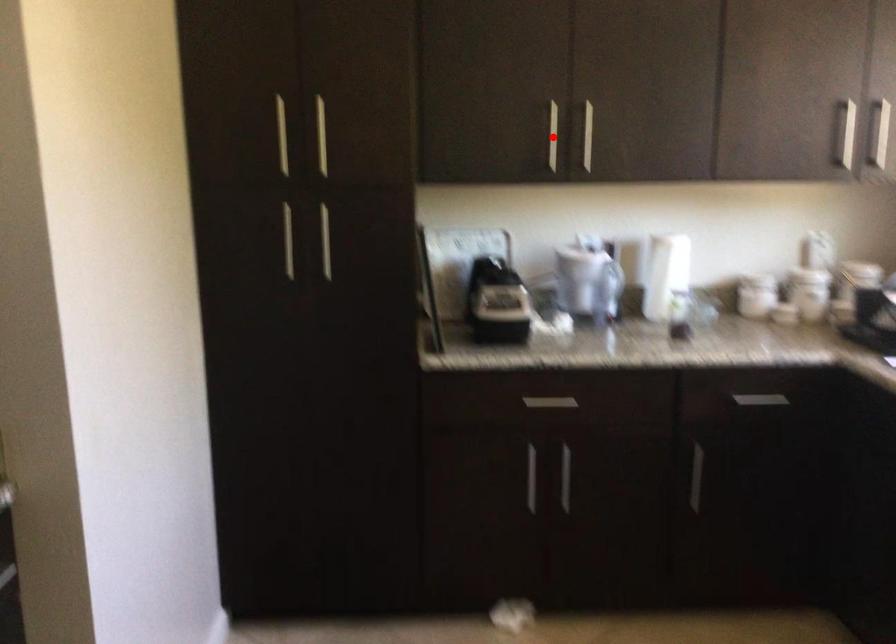
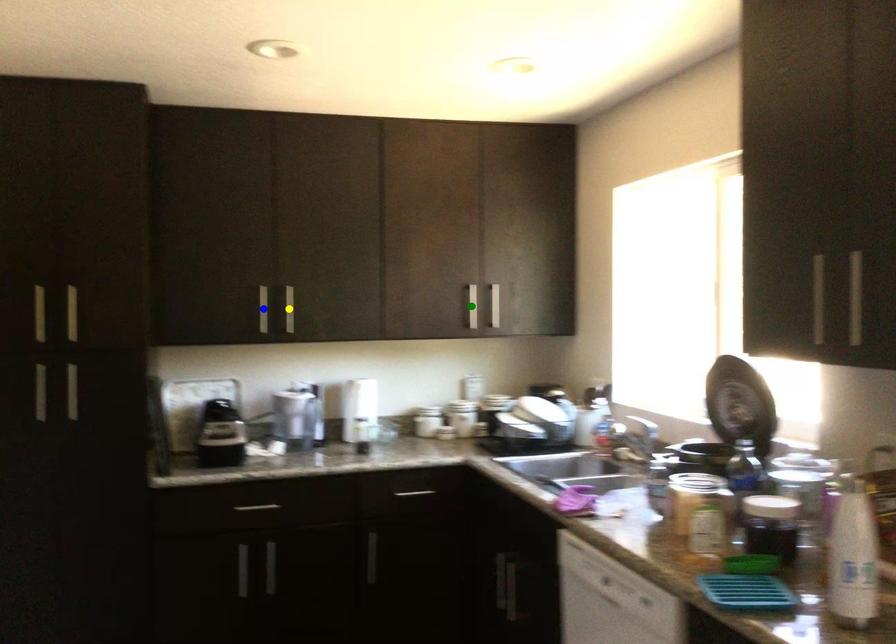
Question: I am providing you with two images of the same scene from different viewpoints. A red point is marked on the first image. You are given multiple points on the second image. Which point in image 2 is actually the same real-world point as the red point in image 1?

Choices:
 (A) green point
 (B) blue point
 (C) yellow point

Answer: (B)